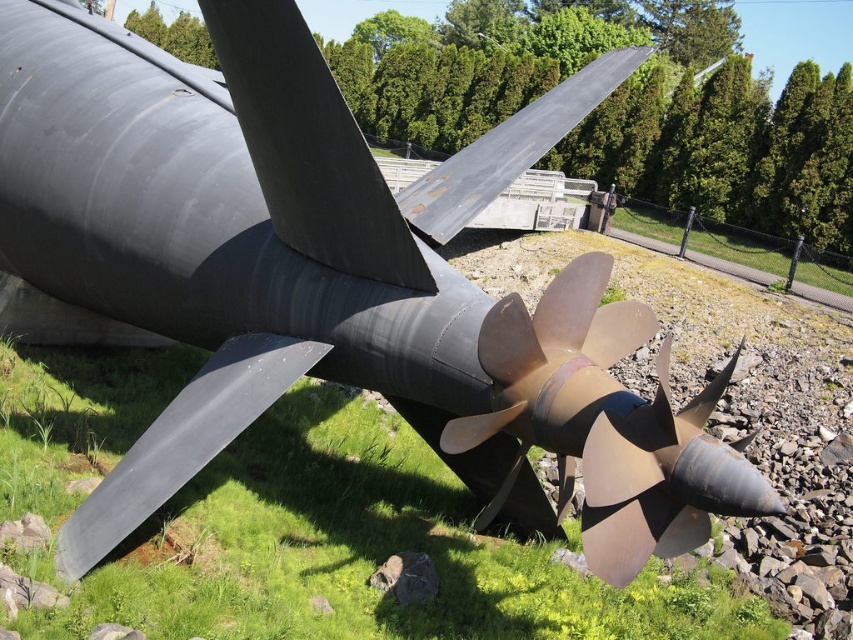
Is the position of green grass at center less distant than that of rusty metallic blade at upper center?

Yes, green grass at center is in front of rusty metallic blade at upper center.

Does green grass at center have a greater width compared to rusty metallic blade at upper center?

Yes.

Is point (282, 630) positioned in front of point (412, 182)?

Yes.

The width and height of the screenshot is (853, 640). In order to click on green grass at center in this screenshot , I will do `click(357, 552)`.

Which is more to the left, green grass at center or matte gold propeller at center?

From the viewer's perspective, green grass at center appears more on the left side.

Can you confirm if green grass at center is smaller than matte gold propeller at center?

No, green grass at center is not smaller than matte gold propeller at center.

Who is more forward, (4, 442) or (663, 417)?

Positioned in front is point (663, 417).

This screenshot has width=853, height=640. What are the coordinates of `green grass at center` in the screenshot? It's located at (357, 552).

Who is more forward, (381, 257) or (582, 84)?

Point (381, 257)

Between point (317, 241) and point (463, 198), which one is positioned behind?

Point (463, 198)

Where is `matte black propeller blade at center`? This screenshot has height=640, width=853. matte black propeller blade at center is located at coordinates (309, 145).